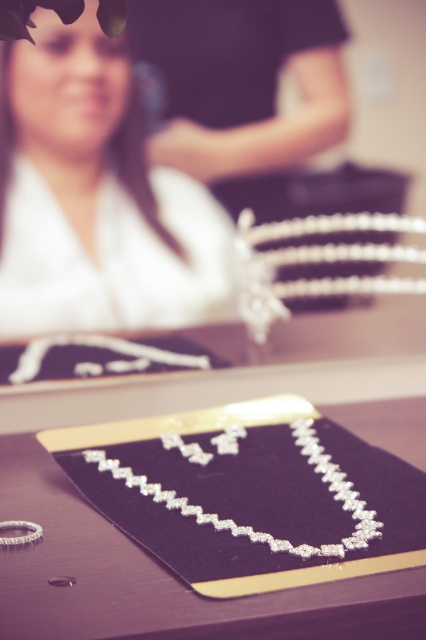
Question: Which of the following is the closest to the observer?

Choices:
 (A) white satin robe at upper left
 (B) matte black jewelry at center
 (C) clear crystal necklace at center

Answer: (B)

Question: Is matte black jewelry at center above clear crystal necklace at center?

Choices:
 (A) no
 (B) yes

Answer: (A)

Question: Is white satin robe at upper left bigger than matte black jewelry at center?

Choices:
 (A) no
 (B) yes

Answer: (B)

Question: Which point appears farthest from the camera in this image?

Choices:
 (A) (187, 253)
 (B) (239, 483)

Answer: (A)

Question: Which is farther from the clear crystal necklace at center?

Choices:
 (A) matte black jewelry at center
 (B) white satin robe at upper left

Answer: (B)

Question: Can you confirm if white satin robe at upper left is positioned to the right of matte black jewelry at center?

Choices:
 (A) yes
 (B) no

Answer: (B)